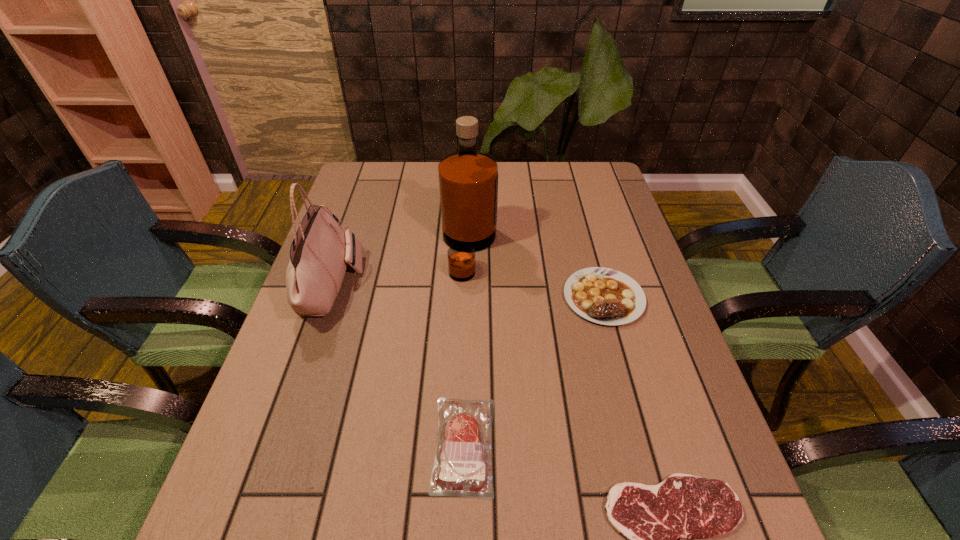
At what (x,y) coordinates should I click in order to perform the action: click on vacant space located 0.140m on the right of the leftmost steak. Please return your answer as a coordinate pair (x, y). This screenshot has height=540, width=960. Looking at the image, I should click on (568, 445).

Image resolution: width=960 pixels, height=540 pixels. I want to click on object that is at the left edge, so click(321, 249).

I want to click on object that is positioned at the right edge, so click(x=605, y=296).

You are a GUI agent. You are given a task and a screenshot of the screen. Output one action in this format:
    pyautogui.click(x=<x>, y=<y>)
    Task: Click on the vacant space at the far edge of the desktop
    
    Given the screenshot: What is the action you would take?
    pyautogui.click(x=503, y=176)

You are a GUI agent. You are given a task and a screenshot of the screen. Output one action in this format:
    pyautogui.click(x=<x>, y=<y>)
    Task: Click on the vacant region at the near edge of the desktop
    This screenshot has width=960, height=540.
    Given the screenshot: What is the action you would take?
    pyautogui.click(x=392, y=538)

This screenshot has width=960, height=540. What are the coordinates of `vacant space at the left edge` in the screenshot? It's located at click(x=324, y=386).

The height and width of the screenshot is (540, 960). In the image, there is a desktop. Identify the location of vacant space at the right edge. coord(603,328).

Where is `vacant space at the far left corner`? Image resolution: width=960 pixels, height=540 pixels. vacant space at the far left corner is located at coordinates (355, 178).

This screenshot has width=960, height=540. In the image, there is a desktop. What are the coordinates of `vacant space at the far right corner` in the screenshot? It's located at (612, 199).

The width and height of the screenshot is (960, 540). In order to click on vacant space that's between the leftmost object and the second shortest object in this screenshot , I will do (398, 365).